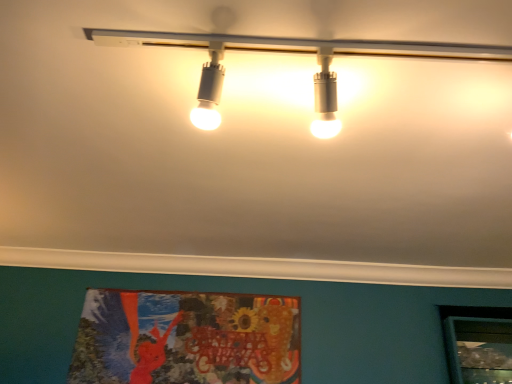
Question: Can you confirm if white glossy track lights at upper center is thinner than textured fabric poster at lower center?

Choices:
 (A) yes
 (B) no

Answer: (B)

Question: Is white glossy track lights at upper center positioned beyond the bounds of textured fabric poster at lower center?

Choices:
 (A) yes
 (B) no

Answer: (A)

Question: Is textured fabric poster at lower center completely or partially inside white glossy track lights at upper center?

Choices:
 (A) no
 (B) yes

Answer: (A)

Question: Can you confirm if white glossy track lights at upper center is shorter than textured fabric poster at lower center?

Choices:
 (A) yes
 (B) no

Answer: (A)

Question: Can you confirm if white glossy track lights at upper center is wider than textured fabric poster at lower center?

Choices:
 (A) yes
 (B) no

Answer: (A)

Question: Could you tell me if white glossy track lights at upper center is turned towards textured fabric poster at lower center?

Choices:
 (A) no
 (B) yes

Answer: (A)

Question: Is textured fabric poster at lower center turned away from white glossy track lights at upper center?

Choices:
 (A) no
 (B) yes

Answer: (A)

Question: Is textured fabric poster at lower center wider than white glossy track lights at upper center?

Choices:
 (A) no
 (B) yes

Answer: (A)

Question: From a real-world perspective, is textured fabric poster at lower center on top of white glossy track lights at upper center?

Choices:
 (A) yes
 (B) no

Answer: (B)

Question: Could white glossy track lights at upper center be considered to be inside textured fabric poster at lower center?

Choices:
 (A) yes
 (B) no

Answer: (B)

Question: Is textured fabric poster at lower center taller than white glossy track lights at upper center?

Choices:
 (A) no
 (B) yes

Answer: (B)

Question: Is textured fabric poster at lower center at the left side of white glossy track lights at upper center?

Choices:
 (A) no
 (B) yes

Answer: (B)

Question: In terms of size, does white glossy track lights at upper center appear bigger or smaller than textured fabric poster at lower center?

Choices:
 (A) big
 (B) small

Answer: (A)